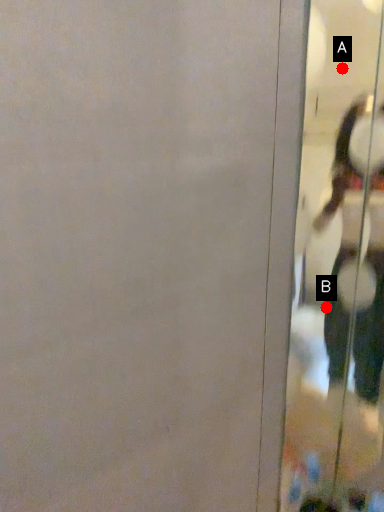
Question: Two points are circled on the image, labeled by A and B beside each circle. Which point appears closest to the camera in this image?

Choices:
 (A) A is closer
 (B) B is closer

Answer: (B)